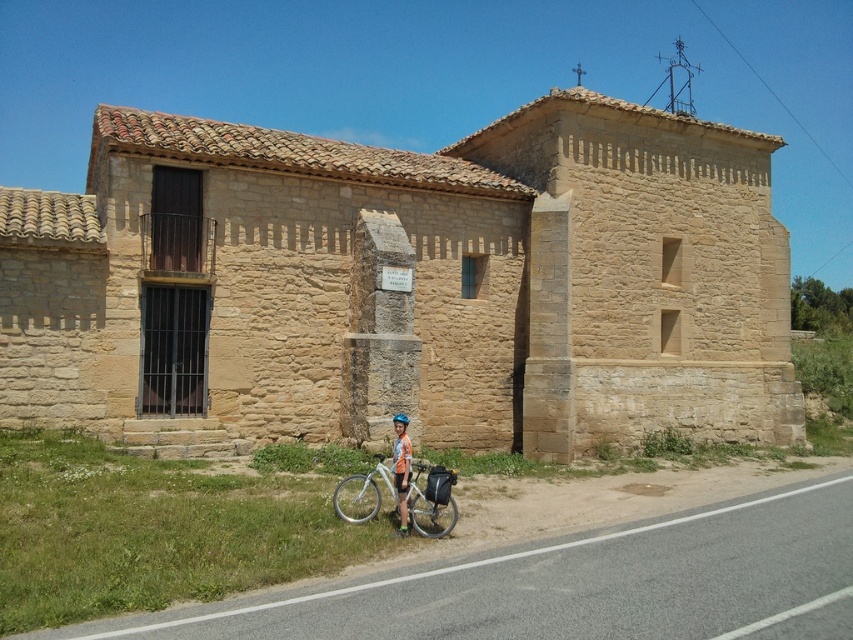
Question: Can you confirm if orange fabric shorts at lower center is smaller than white matte bicycle helmet at center?

Choices:
 (A) yes
 (B) no

Answer: (B)

Question: Is white matte bicycle at lower center bigger than white matte bicycle helmet at center?

Choices:
 (A) no
 (B) yes

Answer: (B)

Question: Which point is farther from the camera taking this photo?

Choices:
 (A) (403, 420)
 (B) (427, 477)
 (C) (393, 452)

Answer: (B)

Question: Among these objects, which one is nearest to the camera?

Choices:
 (A) orange fabric shorts at lower center
 (B) white matte bicycle helmet at center
 (C) white matte bicycle at lower center

Answer: (C)

Question: Which of the following is the closest to the observer?

Choices:
 (A) (403, 422)
 (B) (439, 515)

Answer: (A)

Question: In this image, where is orange fabric shorts at lower center located relative to white matte bicycle helmet at center?

Choices:
 (A) left
 (B) right

Answer: (B)